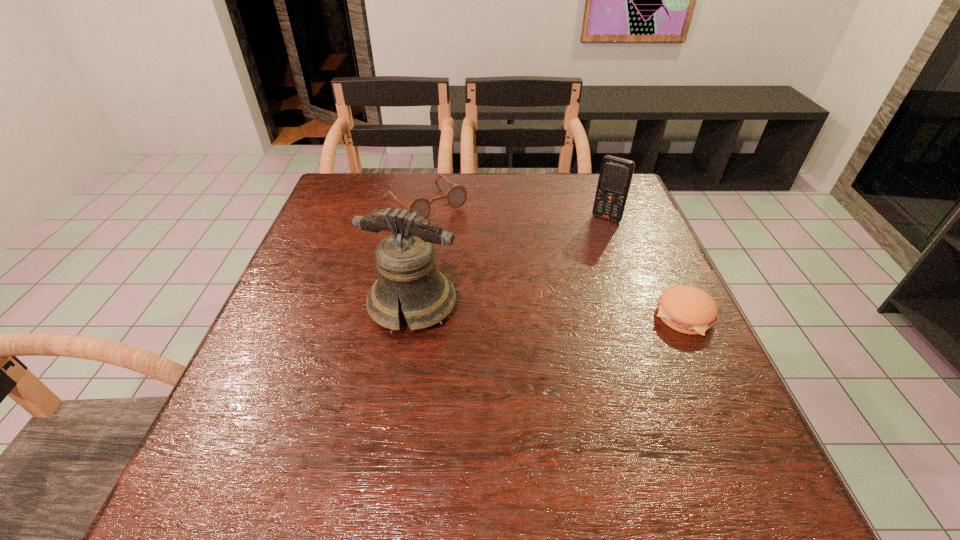
At what (x,y) coordinates should I click in order to perform the action: click on blank space located on the screen of the cellular telephone. Please return your answer as a coordinate pair (x, y). Image resolution: width=960 pixels, height=540 pixels. Looking at the image, I should click on (556, 289).

This screenshot has height=540, width=960. What are the coordinates of `free space located on the screen of the cellular telephone` in the screenshot? It's located at (561, 281).

I want to click on spectacles at the far edge, so click(x=456, y=196).

Image resolution: width=960 pixels, height=540 pixels. In order to click on cellular telephone that is at the far edge in this screenshot , I will do `click(615, 177)`.

What are the coordinates of `patty that is at the right edge` in the screenshot? It's located at (687, 309).

At what (x,y) coordinates should I click in order to perform the action: click on cellular telephone present at the right edge. Please return your answer as a coordinate pair (x, y). This screenshot has width=960, height=540. Looking at the image, I should click on (615, 177).

This screenshot has height=540, width=960. I want to click on object at the far right corner, so click(x=615, y=177).

You are a GUI agent. You are given a task and a screenshot of the screen. Output one action in this format:
    pyautogui.click(x=<x>, y=<y>)
    Task: Click on the free region at the far edge of the desktop
    The width and height of the screenshot is (960, 540).
    Given the screenshot: What is the action you would take?
    pyautogui.click(x=391, y=197)

Identify the location of vacant space at the left edge. (342, 218).

In the image, there is a desktop. Identify the location of vacant space at the right edge. (656, 242).